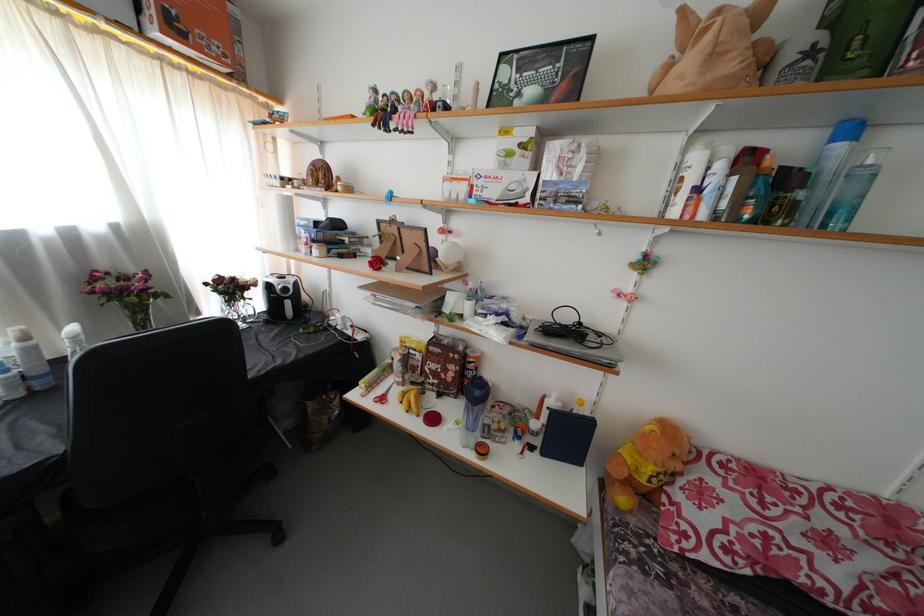
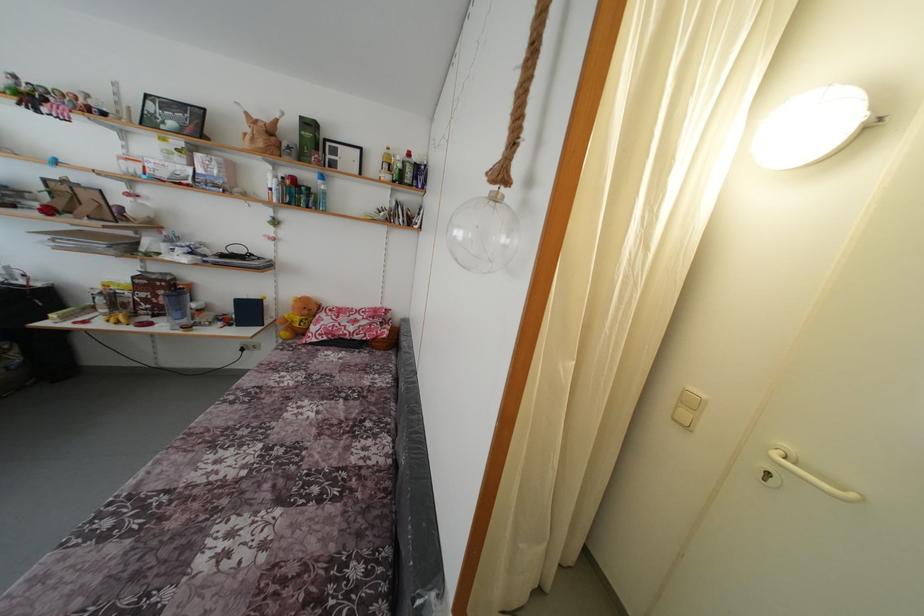
Where in the second image is the point corresponding to point 439,371 from the first image?

(149, 301)